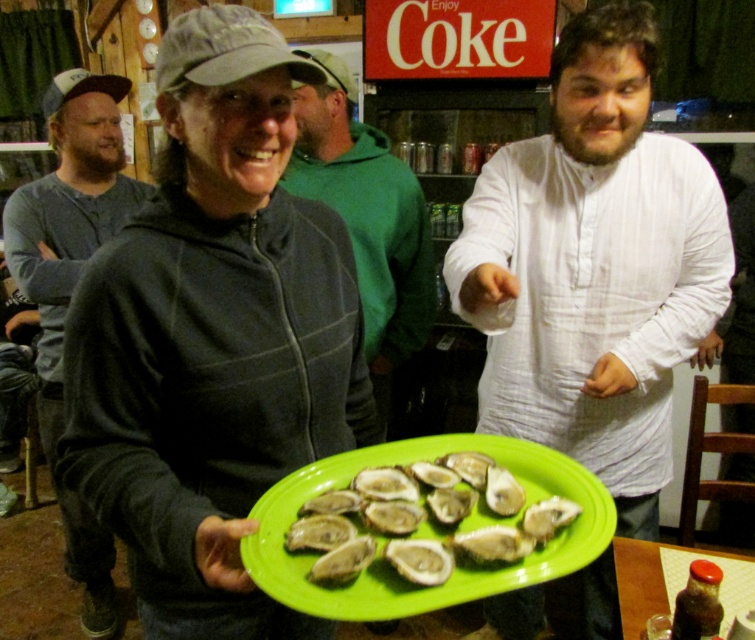
You are at a party and want to take a photo of both the matte gray hoodie at center and the green fleece hoodie at center. Since you can only focus on one at a time, which one should you focus on to ensure it appears clearer in the photo?

The matte gray hoodie at center is closer to the viewer than the green fleece hoodie at center, so focusing on the matte gray hoodie at center will make it clearer in the photo.

You are organizing a photo shoot and need to ensure that all items in the frame are visible. Given that the white textured shirt at center and the green matte oyster at center are both in focus, which object is wider?

The white textured shirt at center is wider than the green matte oyster at center, as the white textured shirt at center surpasses the green matte oyster at center in width.